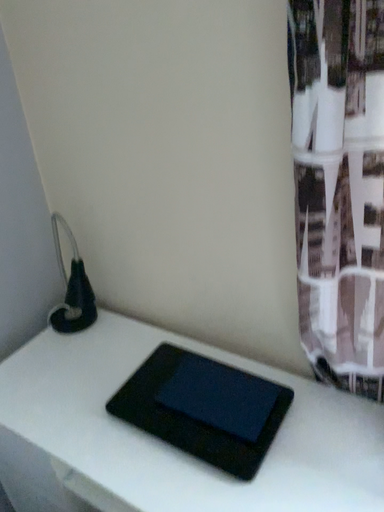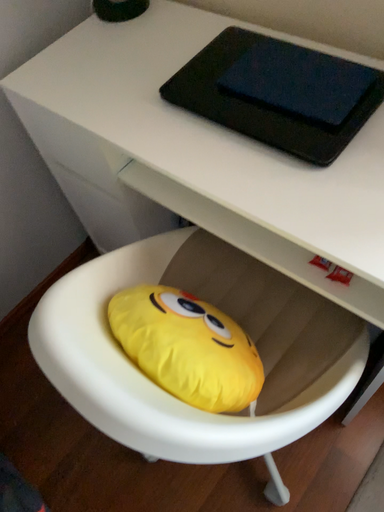
Question: Which way did the camera rotate in the video?

Choices:
 (A) rotated upward
 (B) rotated downward

Answer: (B)